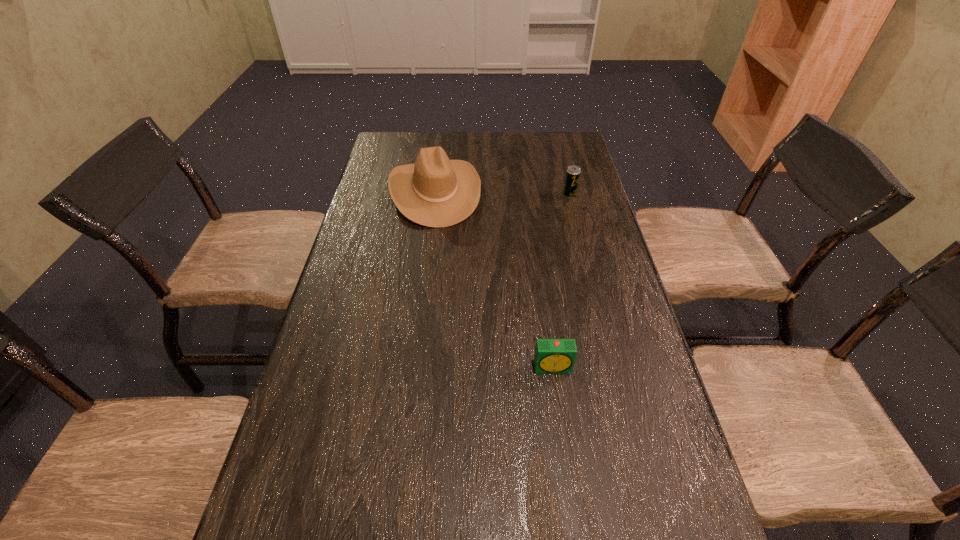
Image resolution: width=960 pixels, height=540 pixels. Identify the location of object present at the right edge. (573, 172).

Image resolution: width=960 pixels, height=540 pixels. Identify the location of object at the far left corner. (434, 191).

Locate an element on the screen. vacant space at the left edge is located at coordinates (373, 189).

This screenshot has width=960, height=540. What are the coordinates of `vacant space at the right edge` in the screenshot? It's located at (610, 508).

Find the location of a particular element. Image resolution: width=960 pixels, height=540 pixels. vacant space at the far left corner of the desktop is located at coordinates (409, 159).

Where is `vacant region at the far right corner`? The width and height of the screenshot is (960, 540). vacant region at the far right corner is located at coordinates (549, 141).

Where is `free space between the beer can and the leftmost object`? This screenshot has width=960, height=540. free space between the beer can and the leftmost object is located at coordinates (502, 193).

You are a GUI agent. You are given a task and a screenshot of the screen. Output one action in this format:
    pyautogui.click(x=<x>, y=<y>)
    Task: Click on the empty space between the cowboy hat and the beer can
    The image size is (960, 540).
    Given the screenshot: What is the action you would take?
    pyautogui.click(x=502, y=193)

Where is `vacant space that is in between the alarm clock and the tallest object`? The image size is (960, 540). vacant space that is in between the alarm clock and the tallest object is located at coordinates (494, 280).

Image resolution: width=960 pixels, height=540 pixels. Find the location of `vacant area between the tallest object and the alarm clock`. vacant area between the tallest object and the alarm clock is located at coordinates pos(494,280).